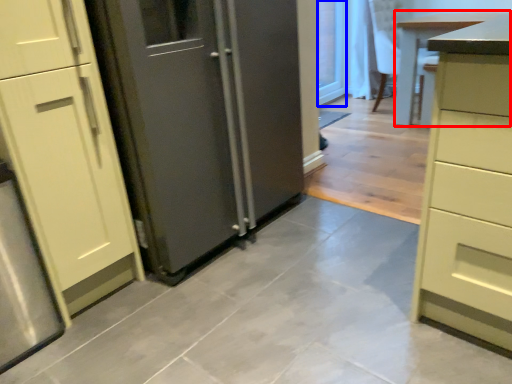
Question: Which object is closer to the camera taking this photo, table (highlighted by a red box) or glass door (highlighted by a blue box)?

Choices:
 (A) table
 (B) glass door

Answer: (A)